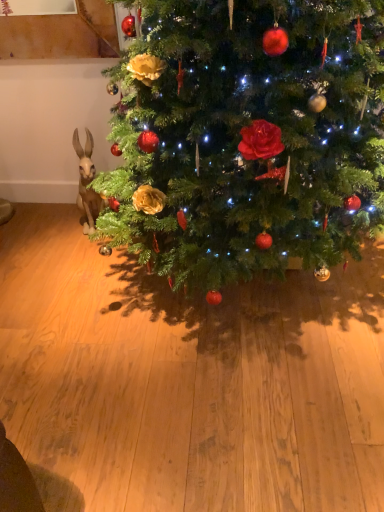
Question: Can you confirm if green matte christmas tree at center is shorter than matte plastic rabbit at left?

Choices:
 (A) no
 (B) yes

Answer: (A)

Question: Is green matte christmas tree at center thinner than matte plastic rabbit at left?

Choices:
 (A) no
 (B) yes

Answer: (A)

Question: Does green matte christmas tree at center have a greater width compared to matte plastic rabbit at left?

Choices:
 (A) no
 (B) yes

Answer: (B)

Question: Can you confirm if green matte christmas tree at center is taller than matte plastic rabbit at left?

Choices:
 (A) yes
 (B) no

Answer: (A)

Question: Is green matte christmas tree at center positioned with its back to matte plastic rabbit at left?

Choices:
 (A) no
 (B) yes

Answer: (A)

Question: Is green matte christmas tree at center aimed at matte plastic rabbit at left?

Choices:
 (A) no
 (B) yes

Answer: (A)

Question: Can you confirm if matte plastic rabbit at left is thinner than green matte christmas tree at center?

Choices:
 (A) no
 (B) yes

Answer: (B)

Question: Can you confirm if matte plastic rabbit at left is shorter than green matte christmas tree at center?

Choices:
 (A) no
 (B) yes

Answer: (B)

Question: Is matte plastic rabbit at left at the left side of green matte christmas tree at center?

Choices:
 (A) yes
 (B) no

Answer: (A)

Question: Would you say matte plastic rabbit at left is outside green matte christmas tree at center?

Choices:
 (A) yes
 (B) no

Answer: (A)

Question: Is the surface of matte plastic rabbit at left in direct contact with green matte christmas tree at center?

Choices:
 (A) yes
 (B) no

Answer: (B)

Question: Does matte plastic rabbit at left have a greater height compared to green matte christmas tree at center?

Choices:
 (A) no
 (B) yes

Answer: (A)

Question: Relative to matte plastic rabbit at left, is green matte christmas tree at center in front or behind?

Choices:
 (A) front
 (B) behind

Answer: (A)